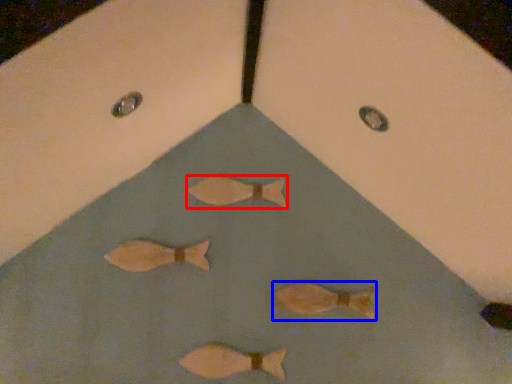
Question: Which object is further to the camera taking this photo, fish (highlighted by a red box) or fish (highlighted by a blue box)?

Choices:
 (A) fish
 (B) fish

Answer: (A)